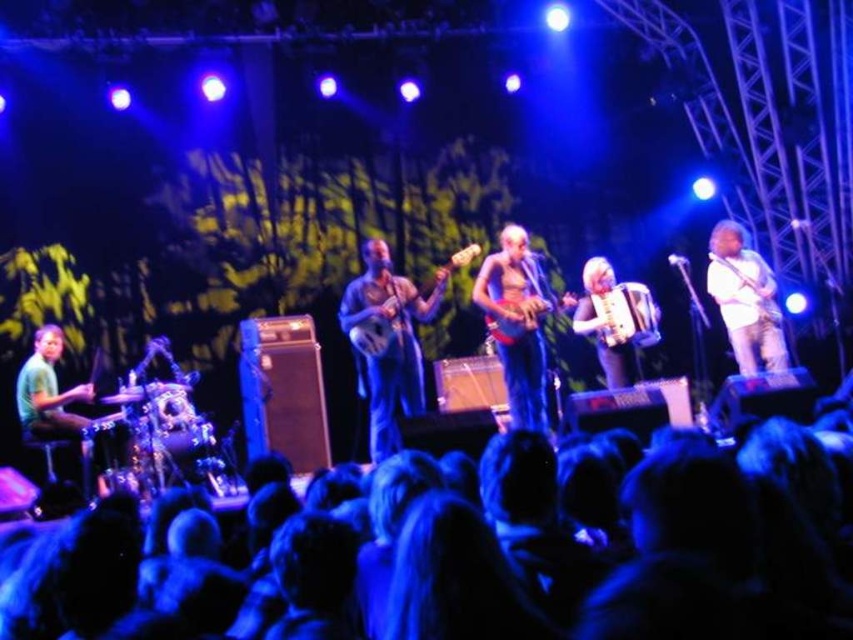
Question: Can you confirm if denim shirt at center is positioned to the right of white glossy electric guitar at right?

Choices:
 (A) no
 (B) yes

Answer: (A)

Question: Can you confirm if white matte guitar at right is thinner than green matte drum set at left?

Choices:
 (A) no
 (B) yes

Answer: (B)

Question: Which object is the closest to the black hair at lower center?

Choices:
 (A) matte wood guitar at center
 (B) shiny blue guitar at center
 (C) white glossy electric guitar at right
 (D) white matte guitar at right

Answer: (A)

Question: Which point is closer to the camera?

Choices:
 (A) wooden percussion instrument at center
 (B) denim shirt at center
 (C) black hair at lower center

Answer: (C)

Question: Which is nearer to the wooden percussion instrument at center?

Choices:
 (A) shiny blue guitar at center
 (B) white glossy electric guitar at right

Answer: (B)

Question: Is denim shirt at center above green matte drum set at left?

Choices:
 (A) yes
 (B) no

Answer: (A)